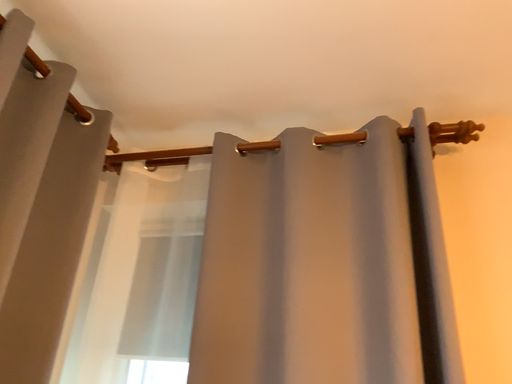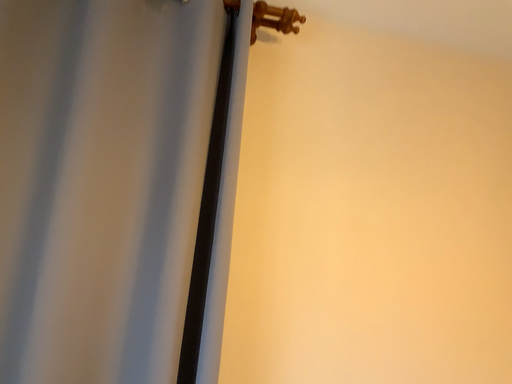
Question: How did the camera likely rotate when shooting the video?

Choices:
 (A) rotated upward
 (B) rotated downward

Answer: (B)